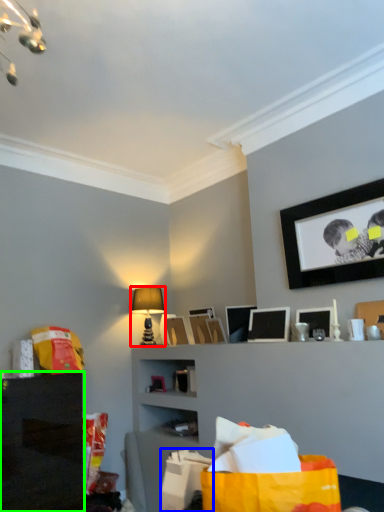
Question: Estimate the real-world distances between objects in this image. Which object is closer to table lamp (highlighted by a red box), shopping bag (highlighted by a blue box) or shelf (highlighted by a green box)?

Choices:
 (A) shopping bag
 (B) shelf

Answer: (B)